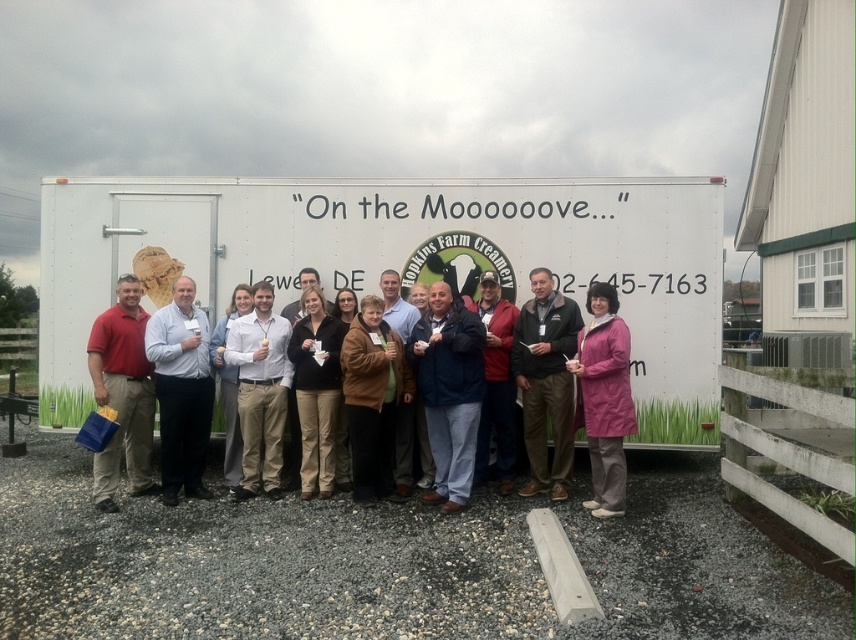
Question: Is dark blue jacket at center thinner than light blue shirt at center?

Choices:
 (A) no
 (B) yes

Answer: (A)

Question: Among these points, which one is farthest from the camera?

Choices:
 (A) (706, 337)
 (B) (337, 392)
 (C) (158, 360)

Answer: (A)

Question: Which is farther from the dark blue jacket at center?

Choices:
 (A) white matte trailer at center
 (B) light blue shirt at center

Answer: (B)

Question: Among these objects, which one is nearest to the camera?

Choices:
 (A) white matte trailer at center
 (B) matte black jacket at center
 (C) brown fabric jacket at center

Answer: (B)

Question: Does matte black jacket at center have a greater width compared to dark blue jacket at center?

Choices:
 (A) no
 (B) yes

Answer: (B)

Question: Considering the relative positions of matte red shirt at left and light blue shirt at center in the image provided, where is matte red shirt at left located with respect to light blue shirt at center?

Choices:
 (A) right
 (B) left

Answer: (B)